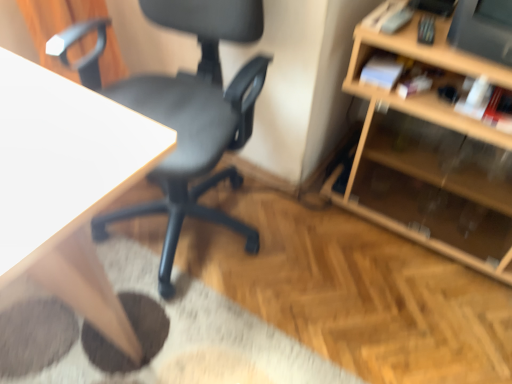
You are a GUI agent. You are given a task and a screenshot of the screen. Output one action in this format:
    pyautogui.click(x=<x>, y=<y>)
    Task: Click on the vacant space to the right of black plastic chair at center
    This screenshot has height=384, width=512.
    Given the screenshot: What is the action you would take?
    (x=331, y=270)